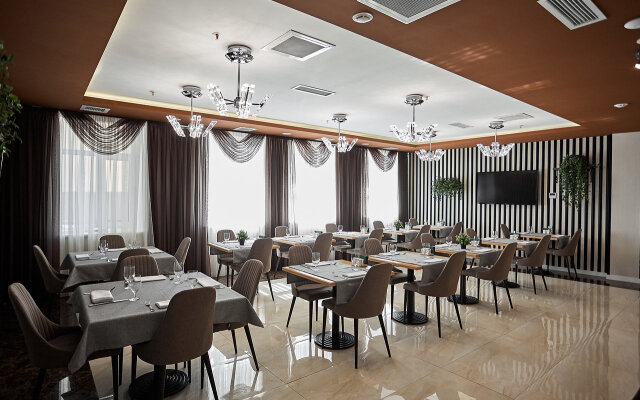
The image size is (640, 400). What are the coordinates of `emergency water sprinkles` in the screenshot? It's located at [x=216, y=31], [x=150, y=93], [x=328, y=120], [x=521, y=126], [x=426, y=94].